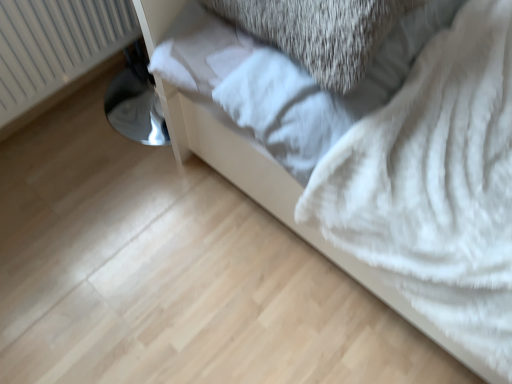
This screenshot has width=512, height=384. What do you see at coordinates (282, 200) in the screenshot?
I see `white fluffy blanket at lower right` at bounding box center [282, 200].

Measure the distance between white plastic radiator at left and camera.

The distance of white plastic radiator at left from camera is 1.05 meters.

Find the location of `white fluffy blanket at lower right`. white fluffy blanket at lower right is located at coordinates (282, 200).

Is point (376, 100) closer to camera compared to point (70, 62)?

Yes, it is in front of point (70, 62).

Considering the relative sizes of white fluffy sheet at center and white plastic radiator at left in the image provided, is white fluffy sheet at center wider than white plastic radiator at left?

In fact, white fluffy sheet at center might be narrower than white plastic radiator at left.

Can you see white fluffy sheet at center touching white plastic radiator at left?

No, white fluffy sheet at center is not touching white plastic radiator at left.

From a real-world perspective, is white fluffy blanket at lower right beneath white plastic radiator at left?

No.

Is point (246, 182) positioned before point (31, 71)?

Yes.

Could you tell me if white fluffy blanket at lower right is turned towards white plastic radiator at left?

No, white fluffy blanket at lower right is not oriented towards white plastic radiator at left.

Which object is further away from the camera taking this photo, white fluffy blanket at lower right or white plastic radiator at left?

white plastic radiator at left is further from the camera.

What are the coordinates of `radiator directly beneath the white fluffy sheet at center (from a real-world perspective)` in the screenshot? It's located at (56, 46).

From the image's perspective, between white plastic radiator at left and white fluffy sheet at center, which one is located above?

white fluffy sheet at center is shown above in the image.

Is white plastic radiator at left not within white fluffy sheet at center?

That's correct, white plastic radiator at left is outside of white fluffy sheet at center.

Which object is wider, white plastic radiator at left or white fluffy sheet at center?

With larger width is white plastic radiator at left.

Is white fluffy sheet at center positioned before white fluffy blanket at lower right?

That is False.

Considering the sizes of objects white fluffy sheet at center and white fluffy blanket at lower right in the image provided, who is wider, white fluffy sheet at center or white fluffy blanket at lower right?

Wider between the two is white fluffy blanket at lower right.

From a real-world perspective, is white fluffy sheet at center positioned under white fluffy blanket at lower right based on gravity?

No, from a real-world perspective, white fluffy sheet at center is not beneath white fluffy blanket at lower right.

Can white fluffy sheet at center be found inside white fluffy blanket at lower right?

Yes, white fluffy sheet at center is inside white fluffy blanket at lower right.

From a real-world perspective, is white fluffy blanket at lower right positioned under white fluffy sheet at center based on gravity?

Yes, from a real-world perspective, white fluffy blanket at lower right is below white fluffy sheet at center.

Which object is positioned more to the left, white fluffy blanket at lower right or white fluffy sheet at center?

From the viewer's perspective, white fluffy sheet at center appears more on the left side.

Is white fluffy sheet at center at the back of white fluffy blanket at lower right?

Yes, white fluffy blanket at lower right is positioned with its back facing white fluffy sheet at center.

Between white plastic radiator at left and white fluffy blanket at lower right, which one appears on the right side from the viewer's perspective?

From the viewer's perspective, white fluffy blanket at lower right appears more on the right side.

Is white plastic radiator at left far away from white fluffy blanket at lower right?

No, white plastic radiator at left is in close proximity to white fluffy blanket at lower right.

From the picture: Can you confirm if white plastic radiator at left is thinner than white fluffy blanket at lower right?

Yes, white plastic radiator at left is thinner than white fluffy blanket at lower right.

Based on the photo, from the image's perspective, is white plastic radiator at left positioned above or below white fluffy blanket at lower right?

From the image's perspective, white plastic radiator at left appears below white fluffy blanket at lower right.

Locate an element on the screen. The height and width of the screenshot is (384, 512). sheet lying in front of the white plastic radiator at left is located at coordinates (285, 81).

At what (x,y) coordinates should I click in order to perform the action: click on furniture lying on the right of white plastic radiator at left. Please return your answer as a coordinate pair (x, y). The width and height of the screenshot is (512, 384). Looking at the image, I should click on (282, 200).

Which object lies further to the anchor point white fluffy blanket at lower right, white plastic radiator at left or white fluffy sheet at center?

The object further to white fluffy blanket at lower right is white plastic radiator at left.

Estimate the real-world distances between objects in this image. Which object is closer to white plastic radiator at left, white fluffy blanket at lower right or white fluffy sheet at center?

Based on the image, white fluffy blanket at lower right appears to be nearer to white plastic radiator at left.

Looking at the image, which one is located further to white fluffy sheet at center, white fluffy blanket at lower right or white plastic radiator at left?

white plastic radiator at left.

Looking at this image, looking at the image, which one is located further to white plastic radiator at left, white fluffy sheet at center or white fluffy blanket at lower right?

white fluffy sheet at center is further to white plastic radiator at left.

Which object lies nearer to the anchor point white fluffy blanket at lower right, white fluffy sheet at center or white plastic radiator at left?

Among the two, white fluffy sheet at center is located nearer to white fluffy blanket at lower right.

Based on their spatial positions, is white plastic radiator at left or white fluffy blanket at lower right closer to white fluffy sheet at center?

Based on the image, white fluffy blanket at lower right appears to be nearer to white fluffy sheet at center.

Locate an element on the screen. sheet located between white plastic radiator at left and white fluffy blanket at lower right in the left-right direction is located at coordinates (285, 81).